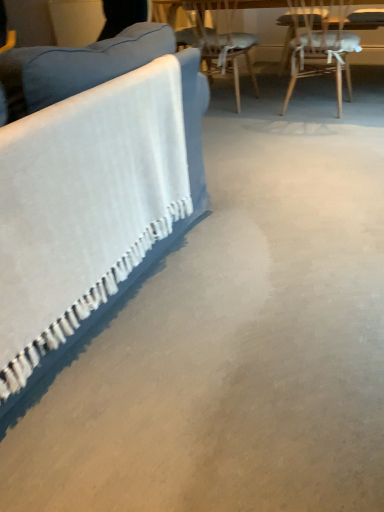
Question: Can you confirm if blue fabric couch at left is shorter than wooden chair at upper right, arranged as the 1th chair when viewed from the left?

Choices:
 (A) yes
 (B) no

Answer: (B)

Question: Could you tell me if blue fabric couch at left is turned towards wooden chair at upper right, which is the second chair in right-to-left order?

Choices:
 (A) no
 (B) yes

Answer: (A)

Question: Can you confirm if blue fabric couch at left is positioned to the right of wooden chair at upper right, arranged as the 1th chair when viewed from the left?

Choices:
 (A) yes
 (B) no

Answer: (B)

Question: Considering the relative sizes of blue fabric couch at left and wooden chair at upper right, arranged as the 1th chair when viewed from the left, in the image provided, is blue fabric couch at left smaller than wooden chair at upper right, arranged as the 1th chair when viewed from the left,?

Choices:
 (A) yes
 (B) no

Answer: (B)

Question: From the image's perspective, would you say blue fabric couch at left is shown under wooden chair at upper right, which is the second chair in right-to-left order?

Choices:
 (A) no
 (B) yes

Answer: (B)

Question: Is wooden chair at upper right, which is the second chair in right-to-left order, inside the boundaries of blue fabric couch at left, or outside?

Choices:
 (A) inside
 (B) outside

Answer: (B)

Question: Would you say wooden chair at upper right, arranged as the 1th chair when viewed from the left, is to the left or to the right of blue fabric couch at left in the picture?

Choices:
 (A) left
 (B) right

Answer: (B)

Question: From the image's perspective, relative to blue fabric couch at left, is wooden chair at upper right, which is the second chair in right-to-left order, above or below?

Choices:
 (A) below
 (B) above

Answer: (B)

Question: From a real-world perspective, relative to blue fabric couch at left, is wooden chair at upper right, arranged as the 1th chair when viewed from the left, vertically above or below?

Choices:
 (A) below
 (B) above

Answer: (A)

Question: Does point (185, 131) appear closer or farther from the camera than point (309, 2)?

Choices:
 (A) farther
 (B) closer

Answer: (B)

Question: Considering their positions, is blue fabric couch at left located in front of or behind wooden chair at upper right, placed as the first chair when sorted from right to left?

Choices:
 (A) front
 (B) behind

Answer: (A)

Question: From a real-world perspective, is blue fabric couch at left positioned above or below wooden chair at upper right, placed as the first chair when sorted from right to left?

Choices:
 (A) above
 (B) below

Answer: (A)

Question: Considering the positions of blue fabric couch at left and wooden chair at upper right, which ranks as the 2th chair in left-to-right order, in the image, is blue fabric couch at left taller or shorter than wooden chair at upper right, which ranks as the 2th chair in left-to-right order,?

Choices:
 (A) tall
 (B) short

Answer: (A)

Question: Relative to blue fabric couch at left, is wooden chair at upper right, which ranks as the 2th chair in left-to-right order, in front or behind?

Choices:
 (A) front
 (B) behind

Answer: (B)

Question: Is point (294, 42) positioned closer to the camera than point (1, 343)?

Choices:
 (A) closer
 (B) farther

Answer: (B)